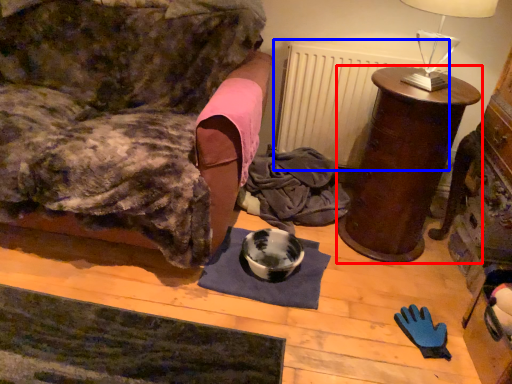
Question: Among these objects, which one is nearest to the camera, furniture (highlighted by a red box) or radiator (highlighted by a blue box)?

Choices:
 (A) furniture
 (B) radiator

Answer: (A)